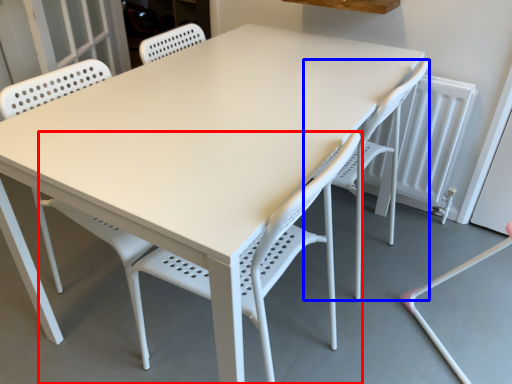
Question: Which object appears farthest to the camera in this image, chair (highlighted by a red box) or swivel chair (highlighted by a blue box)?

Choices:
 (A) chair
 (B) swivel chair

Answer: (B)